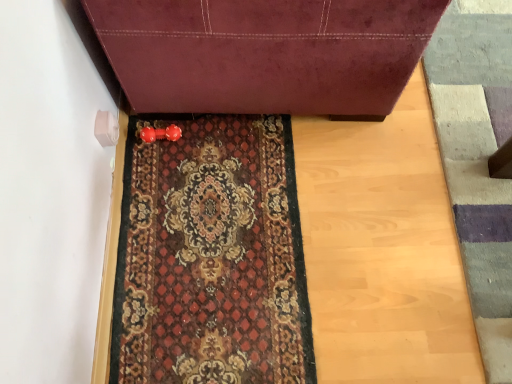
Question: From a real-world perspective, is carpeted mat at center beneath textured wool doormat at lower right?

Choices:
 (A) yes
 (B) no

Answer: (A)

Question: Considering the relative positions of carpeted mat at center and textured wool doormat at lower right in the image provided, is carpeted mat at center to the right of textured wool doormat at lower right from the viewer's perspective?

Choices:
 (A) yes
 (B) no

Answer: (B)

Question: Is carpeted mat at center shorter than textured wool doormat at lower right?

Choices:
 (A) no
 (B) yes

Answer: (B)

Question: Does carpeted mat at center have a lesser width compared to textured wool doormat at lower right?

Choices:
 (A) yes
 (B) no

Answer: (B)

Question: Does carpeted mat at center have a greater height compared to textured wool doormat at lower right?

Choices:
 (A) no
 (B) yes

Answer: (A)

Question: Is textured wool doormat at lower right a part of carpeted mat at center?

Choices:
 (A) no
 (B) yes

Answer: (A)

Question: Does velvet burgundy sofa at center turn towards carpeted mat at center?

Choices:
 (A) yes
 (B) no

Answer: (B)

Question: Can you confirm if velvet burgundy sofa at center is wider than carpeted mat at center?

Choices:
 (A) yes
 (B) no

Answer: (A)

Question: From the image's perspective, is velvet burgundy sofa at center over carpeted mat at center?

Choices:
 (A) yes
 (B) no

Answer: (A)

Question: Does velvet burgundy sofa at center lie in front of carpeted mat at center?

Choices:
 (A) yes
 (B) no

Answer: (A)

Question: Is velvet burgundy sofa at center thinner than carpeted mat at center?

Choices:
 (A) yes
 (B) no

Answer: (B)

Question: Is velvet burgundy sofa at center positioned behind carpeted mat at center?

Choices:
 (A) yes
 (B) no

Answer: (B)

Question: From a real-world perspective, does textured wool doormat at lower right stand above carpeted mat at center?

Choices:
 (A) no
 (B) yes

Answer: (B)